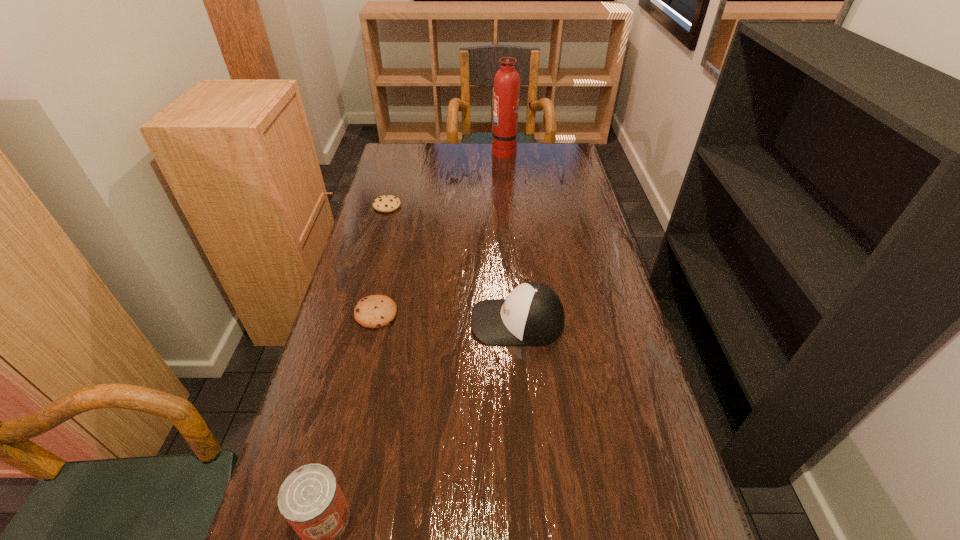
Image resolution: width=960 pixels, height=540 pixels. Find the location of `free space that is in between the fourth nearest object and the farthest object`. free space that is in between the fourth nearest object and the farthest object is located at coordinates pyautogui.click(x=445, y=179).

Locate an element on the screen. vacant space that is in between the second farthest object and the cap is located at coordinates (452, 264).

Find the location of a particular element. blank region between the nearer cookie and the cap is located at coordinates (446, 318).

Locate an element on the screen. The width and height of the screenshot is (960, 540). vacant area between the nearer cookie and the cap is located at coordinates [446, 318].

Identify the location of free spot between the tallest object and the cap. The height and width of the screenshot is (540, 960). (511, 237).

This screenshot has width=960, height=540. Find the location of `object that is the third nearest to the can`. object that is the third nearest to the can is located at coordinates (387, 203).

Identify which object is the second closest to the can. Please provide its 2D coordinates. Your answer should be formatted as a tuple, i.e. [(x, y)], where the tuple contains the x and y coordinates of a point satisfying the conditions above.

[(532, 314)]

The image size is (960, 540). Find the location of `vacant position in the image that satisfies the following two spatial constraints: 1. on the front side of the second farthest object; 2. on the left side of the nearer cookie`. vacant position in the image that satisfies the following two spatial constraints: 1. on the front side of the second farthest object; 2. on the left side of the nearer cookie is located at coordinates (358, 313).

Find the location of a particular element. vacant space that satisfies the following two spatial constraints: 1. on the label side of the tallest object; 2. on the front side of the nearer cookie is located at coordinates (x=517, y=313).

At what (x,y) coordinates should I click in order to perform the action: click on free location that satisfies the following two spatial constraints: 1. on the label side of the fire extinguisher; 2. on the front side of the nearer cookie. Please return your answer as a coordinate pair (x, y). This screenshot has height=540, width=960. Looking at the image, I should click on (517, 313).